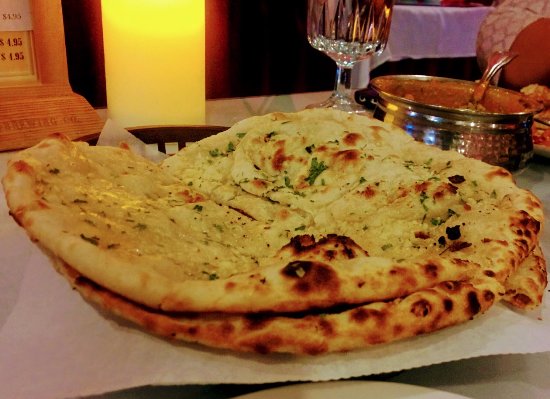
This screenshot has height=399, width=550. Find the location of `plate`. plate is located at coordinates (364, 388).